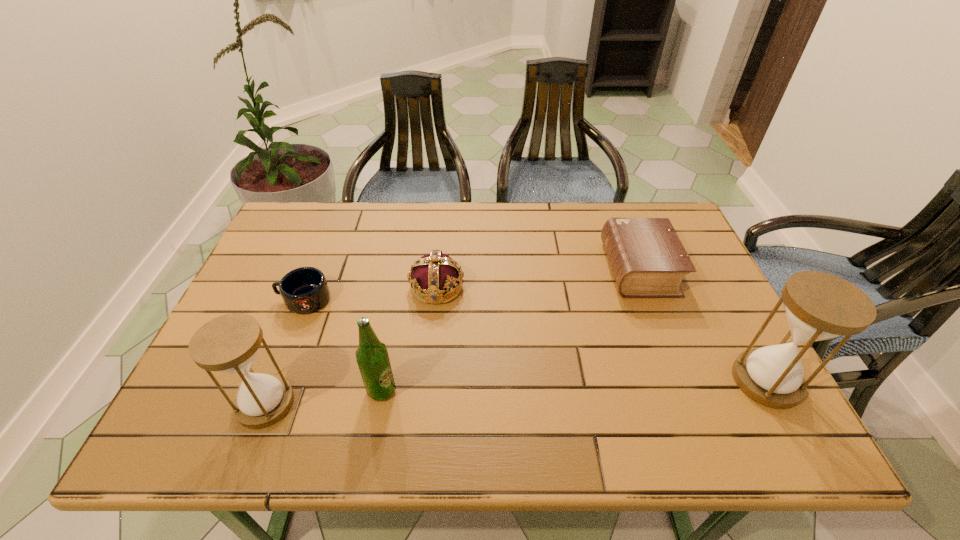
I want to click on free region at the far left corner of the desktop, so click(287, 214).

This screenshot has height=540, width=960. Find the location of `empty location between the taller hourglass and the fifth object from left to right`. empty location between the taller hourglass and the fifth object from left to right is located at coordinates (703, 325).

The image size is (960, 540). Find the location of `vacant space that is in between the rightmost object and the shorter hourglass`. vacant space that is in between the rightmost object and the shorter hourglass is located at coordinates (516, 392).

Find the location of a particular element. This screenshot has height=540, width=960. unoccupied position between the second shortest object and the crown is located at coordinates (538, 278).

This screenshot has height=540, width=960. Find the location of `vacant region between the crown and the shorter hourglass`. vacant region between the crown and the shorter hourglass is located at coordinates (351, 345).

The height and width of the screenshot is (540, 960). Find the location of `blank region between the crown and the Bible`. blank region between the crown and the Bible is located at coordinates (538, 278).

This screenshot has width=960, height=540. Identify the location of empty space between the beer bottle and the left hourglass. (324, 397).

At what (x,y) coordinates should I click in order to perform the action: click on free spot between the beer bottle and the mug. Please return your answer as a coordinate pair (x, y). The image size is (960, 540). Looking at the image, I should click on (343, 345).

What are the coordinates of `free spot between the shorter hourglass and the beer bottle` in the screenshot? It's located at (324, 397).

This screenshot has width=960, height=540. I want to click on vacant area that lies between the crown and the Bible, so click(538, 278).